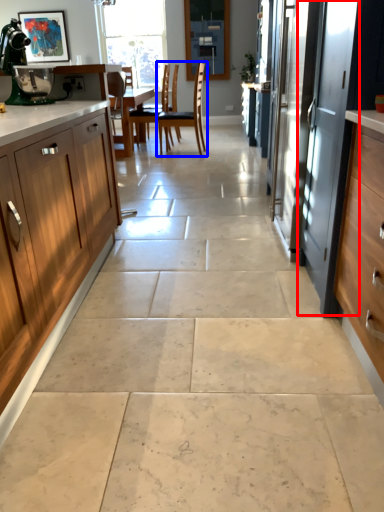
Question: Among these objects, which one is nearest to the camera, screen door (highlighted by a red box) or chair (highlighted by a blue box)?

Choices:
 (A) screen door
 (B) chair

Answer: (A)